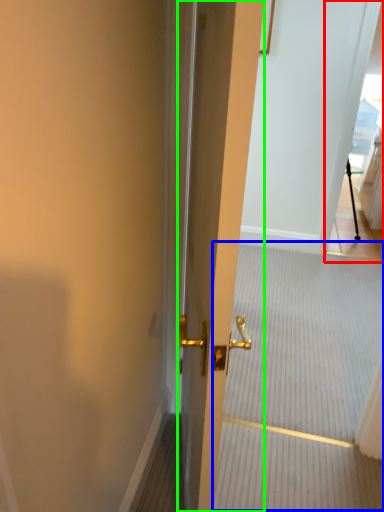
Question: Considering the real-world distances, which object is closest to glass door (highlighted by a red box)? stair (highlighted by a blue box) or door (highlighted by a green box).

Choices:
 (A) stair
 (B) door

Answer: (A)